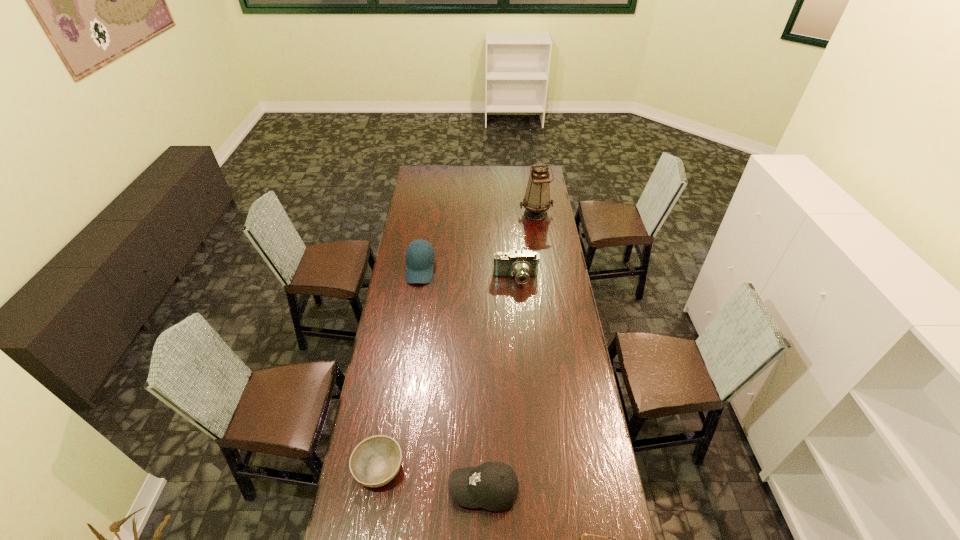
The image size is (960, 540). Identify the location of free spot located on the front-facing side of the camcorder. (518, 313).

Where is `vacant space located on the front-facing side of the nearer baseball cap`? The height and width of the screenshot is (540, 960). vacant space located on the front-facing side of the nearer baseball cap is located at coordinates (410, 490).

Find the location of a particular element. Image resolution: width=960 pixels, height=540 pixels. vacant space situated on the front-facing side of the nearer baseball cap is located at coordinates (371, 490).

The height and width of the screenshot is (540, 960). Identify the location of vacant space located on the front-facing side of the nearer baseball cap. (403, 490).

I want to click on vacant space located on the right of the second shortest object, so click(516, 468).

At what (x,y) coordinates should I click in order to perform the action: click on baseball cap that is positioned at the left edge. Please return your answer as a coordinate pair (x, y). The width and height of the screenshot is (960, 540). Looking at the image, I should click on (419, 266).

The image size is (960, 540). In order to click on bowl present at the left edge in this screenshot , I will do `click(375, 461)`.

I want to click on oil lamp that is at the right edge, so click(x=536, y=202).

I want to click on camcorder located at the right edge, so click(522, 265).

In order to click on vacant space at the far edge of the desktop in this screenshot , I will do `click(509, 183)`.